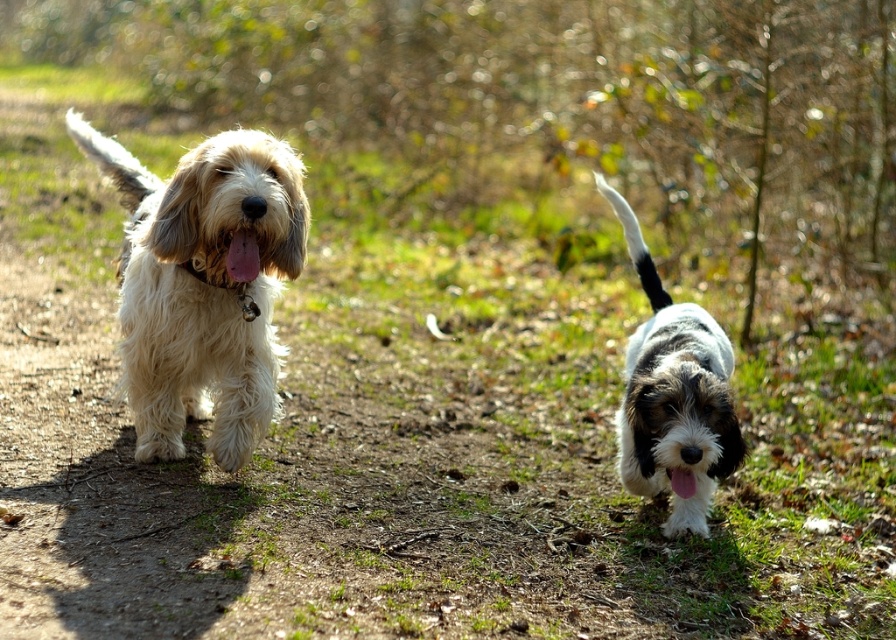
Which is more to the right, white fluffy tail at left or black and white fur tail at right?

black and white fur tail at right

Based on the photo, is white fluffy tail at left positioned in front of black and white fur tail at right?

No, it is not.

The height and width of the screenshot is (640, 896). In order to click on white fluffy tail at left in this screenshot , I will do `click(112, 161)`.

Who is positioned more to the left, fluffy white dog at center or white fluffy tail at left?

white fluffy tail at left is more to the left.

Does fluffy white dog at center have a lesser width compared to white fluffy tail at left?

No.

Locate an element on the screen. The height and width of the screenshot is (640, 896). fluffy white dog at center is located at coordinates (203, 284).

Can you confirm if fluffy white dog at center is positioned to the left of black and white fur tail at right?

Correct, you'll find fluffy white dog at center to the left of black and white fur tail at right.

Is fluffy white dog at center above black and white fur tail at right?

No, fluffy white dog at center is not above black and white fur tail at right.

Which is behind, point (269, 292) or point (642, 276)?

Positioned behind is point (642, 276).

Locate an element on the screen. fluffy white dog at center is located at coordinates (203, 284).